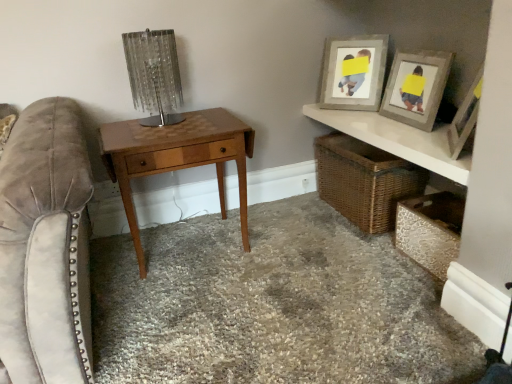
Question: Considering the relative sizes of wooden picture frame at upper right, the 1th picture frame positioned from the back, and carpeted floor at center in the image provided, is wooden picture frame at upper right, the 1th picture frame positioned from the back, taller than carpeted floor at center?

Choices:
 (A) yes
 (B) no

Answer: (A)

Question: Is wooden picture frame at upper right, the 1th picture frame positioned from the back, to the left of carpeted floor at center from the viewer's perspective?

Choices:
 (A) no
 (B) yes

Answer: (A)

Question: Is wooden picture frame at upper right, the second picture frame in the front-to-back sequence, bigger than carpeted floor at center?

Choices:
 (A) yes
 (B) no

Answer: (B)

Question: Is wooden picture frame at upper right, the second picture frame in the front-to-back sequence, facing towards carpeted floor at center?

Choices:
 (A) yes
 (B) no

Answer: (B)

Question: Would you consider wooden picture frame at upper right, the 1th picture frame positioned from the back, to be distant from carpeted floor at center?

Choices:
 (A) yes
 (B) no

Answer: (B)

Question: Is wooden picture frame at upper right, the second picture frame in the front-to-back sequence, inside the boundaries of metallic textured chest at lower right, which is counted as the first shelf, starting from the bottom, or outside?

Choices:
 (A) outside
 (B) inside

Answer: (A)

Question: Considering the positions of wooden picture frame at upper right, the 1th picture frame positioned from the back, and metallic textured chest at lower right, which is counted as the first shelf, starting from the bottom, in the image, is wooden picture frame at upper right, the 1th picture frame positioned from the back, wider or thinner than metallic textured chest at lower right, which is counted as the first shelf, starting from the bottom,?

Choices:
 (A) wide
 (B) thin

Answer: (B)

Question: From a real-world perspective, is wooden picture frame at upper right, the second picture frame in the front-to-back sequence, positioned above or below metallic textured chest at lower right, which is counted as the first shelf, starting from the bottom?

Choices:
 (A) above
 (B) below

Answer: (A)

Question: From the image's perspective, relative to metallic textured chest at lower right, which is counted as the first shelf, starting from the bottom, is wooden picture frame at upper right, the 1th picture frame positioned from the back, above or below?

Choices:
 (A) above
 (B) below

Answer: (A)

Question: From a real-world perspective, is wooden picture frame at upper right, the second picture frame in the front-to-back sequence, positioned above or below woven brown basket at lower right?

Choices:
 (A) above
 (B) below

Answer: (A)

Question: In terms of height, does wooden picture frame at upper right, the second picture frame in the front-to-back sequence, look taller or shorter compared to woven brown basket at lower right?

Choices:
 (A) tall
 (B) short

Answer: (A)

Question: Considering their positions, is wooden picture frame at upper right, the 1th picture frame positioned from the back, located in front of or behind woven brown basket at lower right?

Choices:
 (A) front
 (B) behind

Answer: (B)

Question: From the image's perspective, is wooden picture frame at upper right, the second picture frame in the front-to-back sequence, above or below woven brown basket at lower right?

Choices:
 (A) below
 (B) above

Answer: (B)

Question: From their relative heights in the image, would you say carpeted floor at center is taller or shorter than metallic textured chest at lower right, the second shelf positioned from the top?

Choices:
 (A) tall
 (B) short

Answer: (B)

Question: In the image, is carpeted floor at center positioned in front of or behind metallic textured chest at lower right, the second shelf positioned from the top?

Choices:
 (A) front
 (B) behind

Answer: (A)